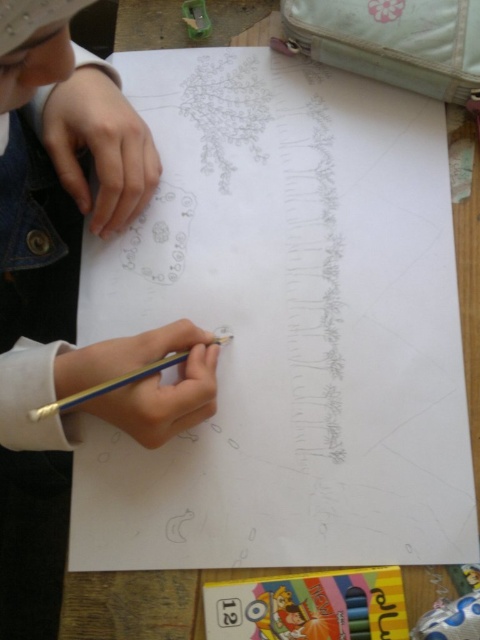
Can you confirm if pencil sketch paper at center is positioned to the left of metallic blue pencil at lower center?

In fact, pencil sketch paper at center is to the right of metallic blue pencil at lower center.

Who is positioned more to the left, pencil sketch paper at center or metallic blue pencil at lower center?

From the viewer's perspective, metallic blue pencil at lower center appears more on the left side.

Identify the location of pencil sketch paper at center. This screenshot has height=640, width=480. (285, 324).